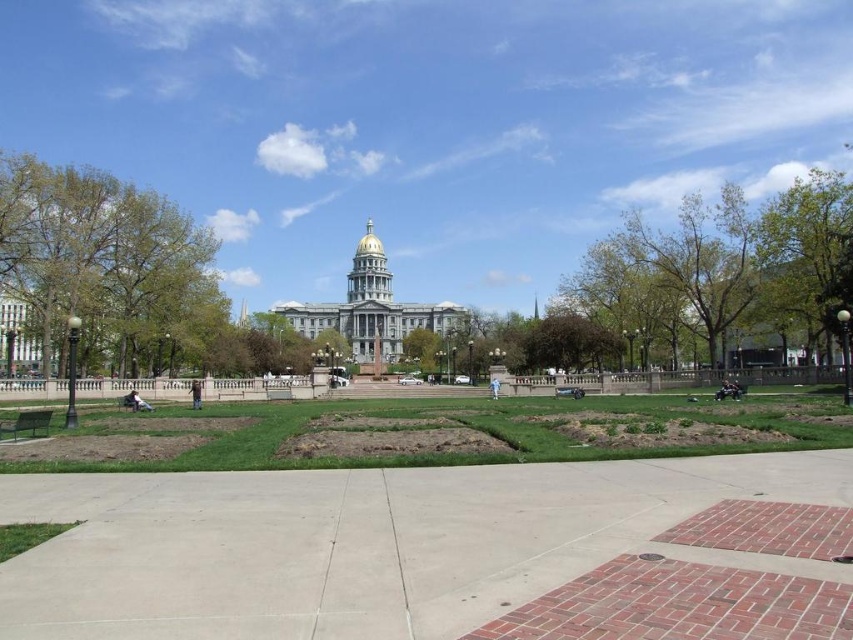
Is concrete at center shorter than green leafy tree at upper right?

Correct, concrete at center is not as tall as green leafy tree at upper right.

Is point (575, 488) in front of point (776, 305)?

Yes, point (575, 488) is closer to viewer.

Is point (457, 472) closer to viewer compared to point (827, 234)?

That is True.

Locate an element on the screen. concrete at center is located at coordinates (364, 541).

Is point (155, 636) behind point (204, 257)?

No.

Can you confirm if concrete at center is wider than green leafy tree at left?

Indeed, concrete at center has a greater width compared to green leafy tree at left.

Identify the location of concrete at center. (364, 541).

Locate an element on the screen. concrete at center is located at coordinates (364, 541).

Can you confirm if green leafy tree at left is positioned to the right of green leafy tree at upper right?

Incorrect, green leafy tree at left is not on the right side of green leafy tree at upper right.

Does green leafy tree at left come behind green leafy tree at upper right?

No.

Between point (7, 284) and point (776, 256), which one is positioned in front?

Point (7, 284)

You are a GUI agent. You are given a task and a screenshot of the screen. Output one action in this format:
    pyautogui.click(x=<x>, y=<y>)
    Task: Click on the green leafy tree at left
    This screenshot has width=853, height=640.
    Given the screenshot: What is the action you would take?
    pyautogui.click(x=97, y=257)